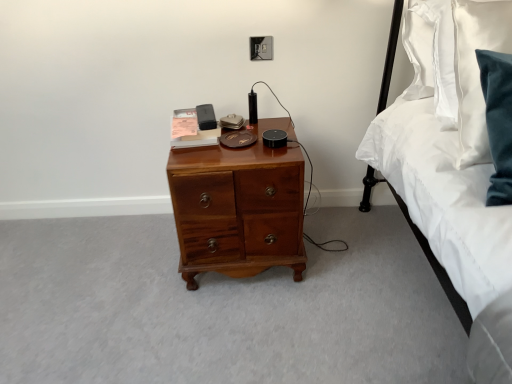
Question: Considering the relative sizes of shiny brown wooden chest of drawers at center and black plastic electric outlet at upper center in the image provided, is shiny brown wooden chest of drawers at center thinner than black plastic electric outlet at upper center?

Choices:
 (A) yes
 (B) no

Answer: (B)

Question: From a real-world perspective, is shiny brown wooden chest of drawers at center on black plastic electric outlet at upper center?

Choices:
 (A) no
 (B) yes

Answer: (A)

Question: Does shiny brown wooden chest of drawers at center appear on the left side of black plastic electric outlet at upper center?

Choices:
 (A) no
 (B) yes

Answer: (B)

Question: Is shiny brown wooden chest of drawers at center with black plastic electric outlet at upper center?

Choices:
 (A) yes
 (B) no

Answer: (B)

Question: From the image's perspective, is shiny brown wooden chest of drawers at center under black plastic electric outlet at upper center?

Choices:
 (A) yes
 (B) no

Answer: (A)

Question: Does point (266, 56) appear closer or farther from the camera than point (283, 213)?

Choices:
 (A) farther
 (B) closer

Answer: (A)

Question: From a real-world perspective, is black plastic electric outlet at upper center above or below shiny brown wooden chest of drawers at center?

Choices:
 (A) above
 (B) below

Answer: (A)

Question: Is black plastic electric outlet at upper center inside the boundaries of shiny brown wooden chest of drawers at center, or outside?

Choices:
 (A) inside
 (B) outside

Answer: (B)

Question: Would you say black plastic electric outlet at upper center is to the left or to the right of shiny brown wooden chest of drawers at center in the picture?

Choices:
 (A) right
 (B) left

Answer: (A)

Question: From a real-world perspective, relative to black plastic electric outlet at upper center, is shiny brown wooden chest of drawers at center vertically above or below?

Choices:
 (A) below
 (B) above

Answer: (A)

Question: Considering the positions of shiny brown wooden chest of drawers at center and black plastic electric outlet at upper center in the image, is shiny brown wooden chest of drawers at center taller or shorter than black plastic electric outlet at upper center?

Choices:
 (A) short
 (B) tall

Answer: (B)

Question: Is point (291, 261) positioned closer to the camera than point (262, 44)?

Choices:
 (A) closer
 (B) farther

Answer: (A)

Question: Based on their positions, is shiny brown wooden chest of drawers at center located to the left or right of black plastic electric outlet at upper center?

Choices:
 (A) right
 (B) left

Answer: (B)

Question: Is shiny brown wooden chest of drawers at center wider or thinner than white satin bed at right?

Choices:
 (A) thin
 (B) wide

Answer: (A)

Question: In the image, is shiny brown wooden chest of drawers at center on the left side or the right side of white satin bed at right?

Choices:
 (A) left
 (B) right

Answer: (A)